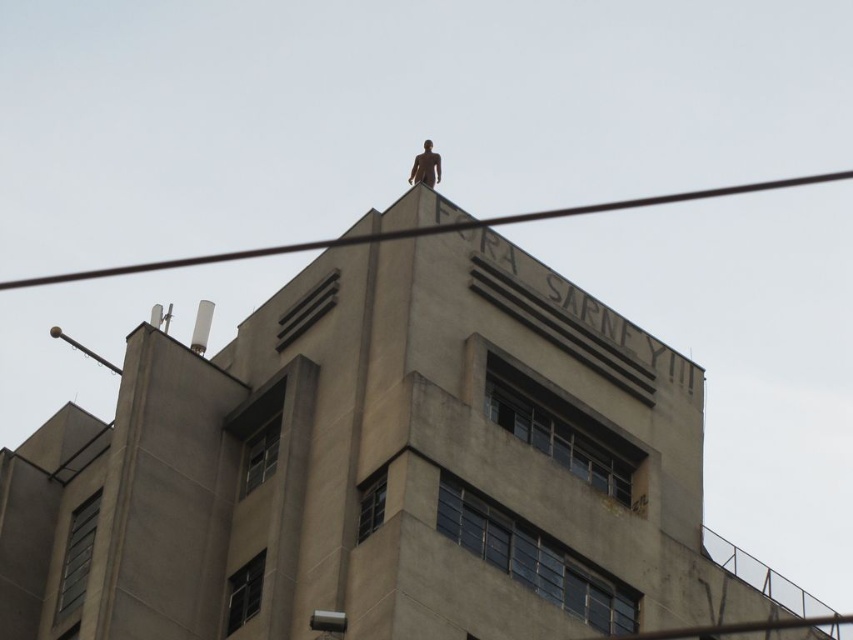
This screenshot has height=640, width=853. What do you see at coordinates (426, 228) in the screenshot? I see `black wire at upper center` at bounding box center [426, 228].

Can you confirm if black wire at upper center is positioned to the right of bronze statue at top?

In fact, black wire at upper center is to the left of bronze statue at top.

This screenshot has width=853, height=640. What do you see at coordinates (426, 228) in the screenshot?
I see `black wire at upper center` at bounding box center [426, 228].

Identify the location of black wire at upper center. This screenshot has height=640, width=853. (426, 228).